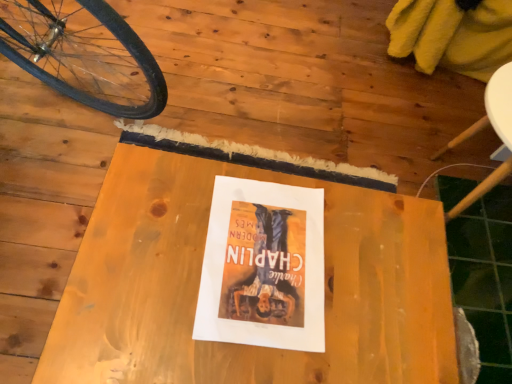
Locate an element on the screen. free space above white paper at center (from a real-world perspective) is located at coordinates point(262,256).